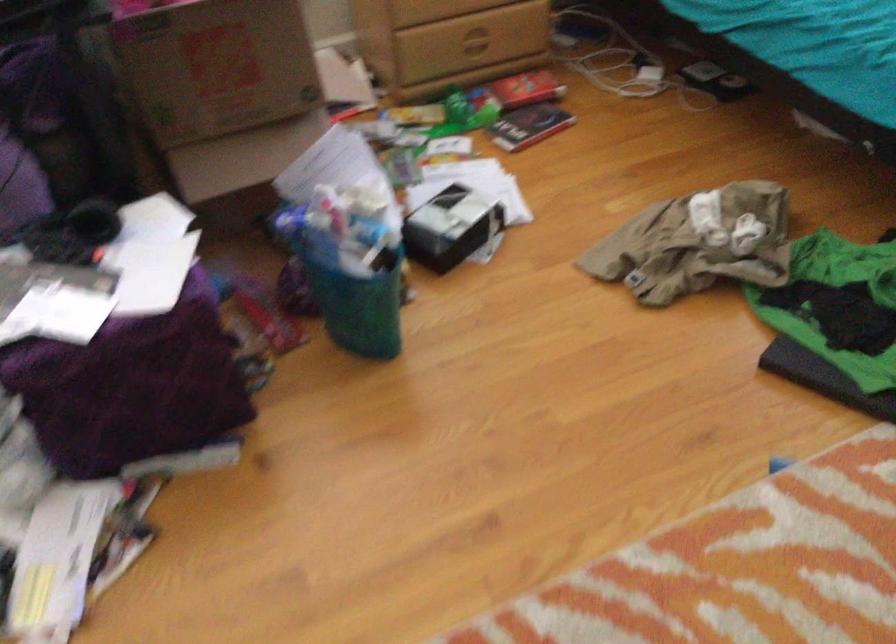
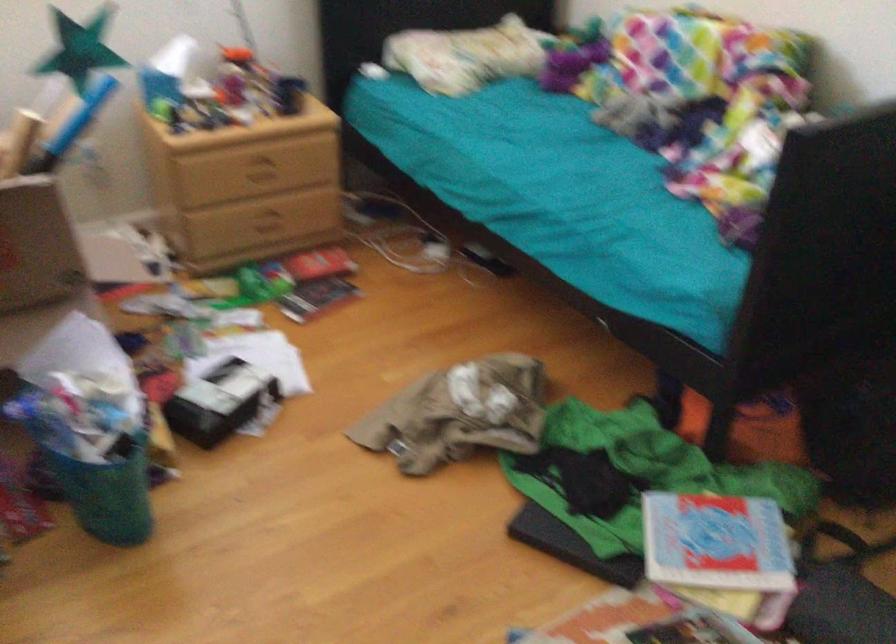
The point at (x=366, y=313) is marked in the first image. Where is the corresponding point in the second image?

(107, 494)